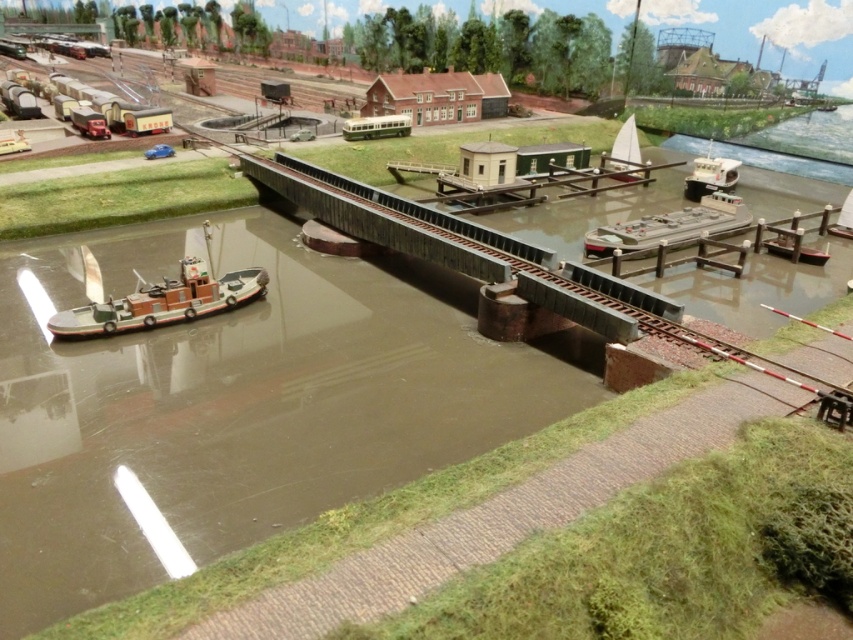
Question: Can you confirm if white matte sailboat at upper center is smaller than white matte sailboat at center-right?

Choices:
 (A) no
 (B) yes

Answer: (A)

Question: Observing the image, what is the correct spatial positioning of white plastic boat at upper right in reference to white matte sailboat at center-right?

Choices:
 (A) above
 (B) below

Answer: (A)

Question: Estimate the real-world distances between objects in this image. Which object is closer to the brown wooden boat at lower left?

Choices:
 (A) metallic gray barge at center-right
 (B) white matte sailboat at center-right
 (C) brown matte waterway at center
 (D) white matte sailboat at upper center

Answer: (C)

Question: Which object is positioned closest to the metallic gray barge at center-right?

Choices:
 (A) white matte sailboat at center-right
 (B) white plastic boat at upper right
 (C) brown matte waterway at center
 (D) white matte sailboat at upper center

Answer: (B)

Question: Among these objects, which one is nearest to the camera?

Choices:
 (A) brown matte waterway at center
 (B) metallic gray barge at center-right
 (C) white plastic boat at upper right
 (D) white matte sailboat at center-right

Answer: (A)

Question: Is white plastic boat at upper right further to the viewer compared to white matte sailboat at center-right?

Choices:
 (A) no
 (B) yes

Answer: (B)